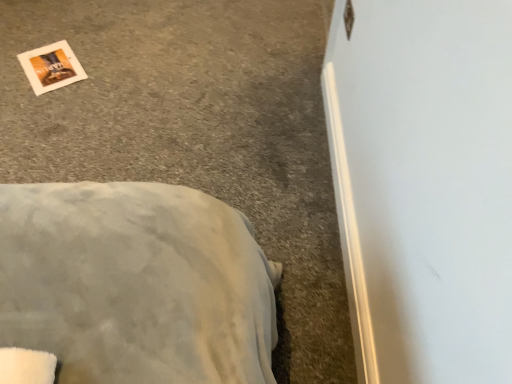
This screenshot has height=384, width=512. What do you see at coordinates (197, 133) in the screenshot?
I see `gray carpet at lower left` at bounding box center [197, 133].

Identify the location of gray carpet at lower left. (197, 133).

What do you see at coordinates (51, 67) in the screenshot?
I see `white paper at upper left` at bounding box center [51, 67].

Measure the distance between white paper at upper left and camera.

The distance of white paper at upper left from camera is 5.51 feet.

Locate an element on the screen. white paper at upper left is located at coordinates 51,67.

Identify the location of gray carpet at lower left. The image size is (512, 384). (197, 133).

Which is more to the left, gray carpet at lower left or white paper at upper left?

white paper at upper left is more to the left.

Considering their positions, is gray carpet at lower left located in front of or behind white paper at upper left?

Visually, gray carpet at lower left is located in front of white paper at upper left.

Does point (197, 150) come farther from viewer compared to point (57, 68)?

No, (197, 150) is closer to viewer.

From the image's perspective, does gray carpet at lower left appear higher than white paper at upper left?

No.

From a real-world perspective, which object rests below the other?

gray carpet at lower left is physically lower.

Can you confirm if gray carpet at lower left is thinner than white paper at upper left?

In fact, gray carpet at lower left might be wider than white paper at upper left.

Is gray carpet at lower left taller or shorter than white paper at upper left?

gray carpet at lower left is taller than white paper at upper left.

Can you confirm if gray carpet at lower left is smaller than white paper at upper left?

Incorrect, gray carpet at lower left is not smaller in size than white paper at upper left.

Is gray carpet at lower left not within white paper at upper left?

Indeed, gray carpet at lower left is completely outside white paper at upper left.

Are gray carpet at lower left and white paper at upper left located far from each other?

No, there isn't a large distance between gray carpet at lower left and white paper at upper left.

Is gray carpet at lower left turned away from white paper at upper left?

Yes, white paper at upper left is at the back of gray carpet at lower left.

Locate an element on the screen. The width and height of the screenshot is (512, 384). postcard behind the gray carpet at lower left is located at coordinates (51, 67).

Does white paper at upper left appear on the left side of gray carpet at lower left?

Yes.

In the image, is white paper at upper left positioned in front of or behind gray carpet at lower left?

white paper at upper left is behind gray carpet at lower left.

Is point (84, 73) positioned in front of point (157, 116)?

No.

From the image's perspective, relative to gray carpet at lower left, is white paper at upper left above or below?

Clearly, from the image's perspective, white paper at upper left is above gray carpet at lower left.

From a real-world perspective, is white paper at upper left located higher than gray carpet at lower left?

Indeed, from a real-world perspective, white paper at upper left stands above gray carpet at lower left.

Considering the relative sizes of white paper at upper left and gray carpet at lower left in the image provided, is white paper at upper left wider than gray carpet at lower left?

No.

Considering the sizes of white paper at upper left and gray carpet at lower left in the image, is white paper at upper left taller or shorter than gray carpet at lower left?

white paper at upper left is shorter than gray carpet at lower left.

Considering the sizes of objects white paper at upper left and gray carpet at lower left in the image provided, who is smaller, white paper at upper left or gray carpet at lower left?

With smaller size is white paper at upper left.

Does white paper at upper left contain gray carpet at lower left?

No, white paper at upper left does not contain gray carpet at lower left.

Is white paper at upper left next to gray carpet at lower left?

No, white paper at upper left is not in contact with gray carpet at lower left.

Is white paper at upper left turned away from gray carpet at lower left?

Correct, white paper at upper left is looking away from gray carpet at lower left.

Image resolution: width=512 pixels, height=384 pixels. I want to click on concrete on the right of white paper at upper left, so click(x=197, y=133).

This screenshot has width=512, height=384. What are the coordinates of `concrete in front of the white paper at upper left` in the screenshot? It's located at (197, 133).

This screenshot has height=384, width=512. Identify the location of concrete below the white paper at upper left (from a real-world perspective). (197, 133).